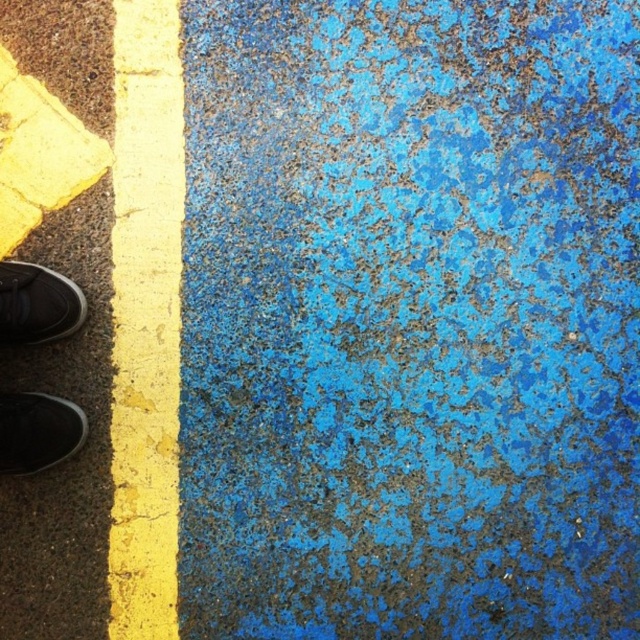
Question: Which is farther from the black suede shoe at lower left?

Choices:
 (A) yellow painted line at left
 (B) matte black shoe at lower left

Answer: (A)

Question: Estimate the real-world distances between objects in this image. Which object is farther from the black suede shoe at lower left?

Choices:
 (A) yellow painted line at left
 (B) matte black shoe at lower left

Answer: (A)

Question: In this image, where is matte black shoe at lower left located relative to black suede shoe at lower left?

Choices:
 (A) right
 (B) left

Answer: (A)

Question: Is yellow painted line at left positioned before black suede shoe at lower left?

Choices:
 (A) no
 (B) yes

Answer: (A)

Question: Is yellow painted line at left to the left of matte black shoe at lower left from the viewer's perspective?

Choices:
 (A) yes
 (B) no

Answer: (B)

Question: Which point is closer to the camera?

Choices:
 (A) (29, 284)
 (B) (76, 424)
 (C) (120, 481)

Answer: (A)